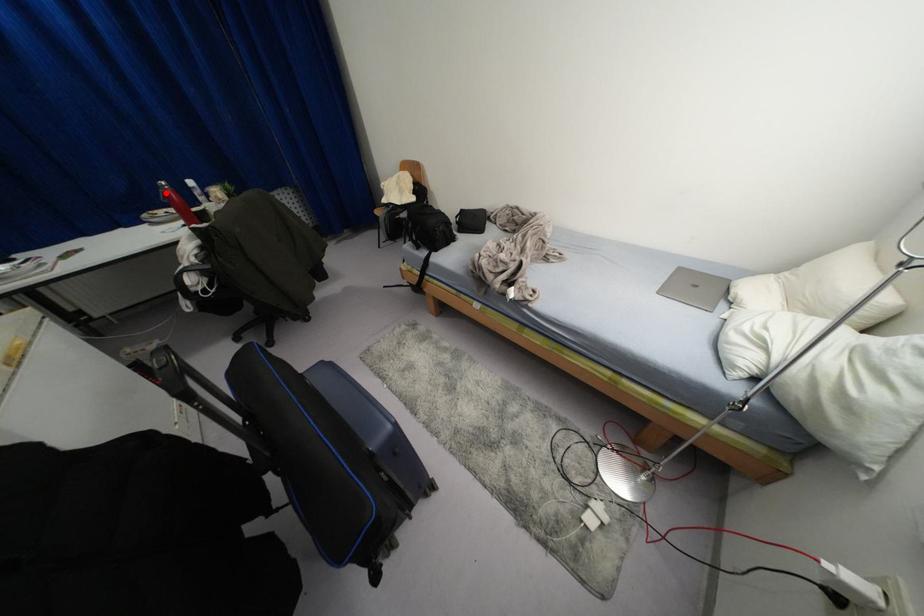
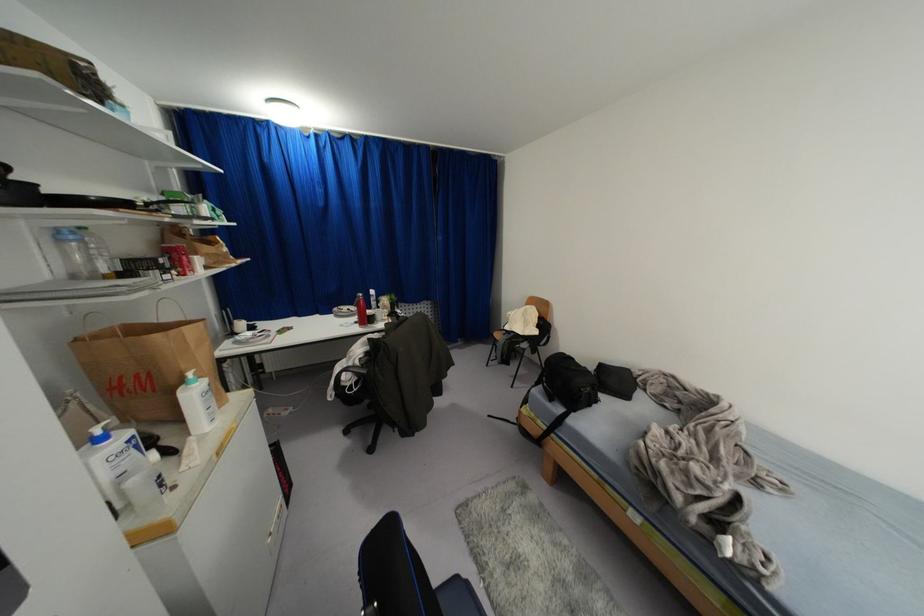
Question: I am providing you with two images of the same scene from different viewpoints. A red point is shown in image1. For the corresponding object point in image2, is it positioned nearer or farther from the camera?

Choices:
 (A) Nearer
 (B) Farther

Answer: (A)